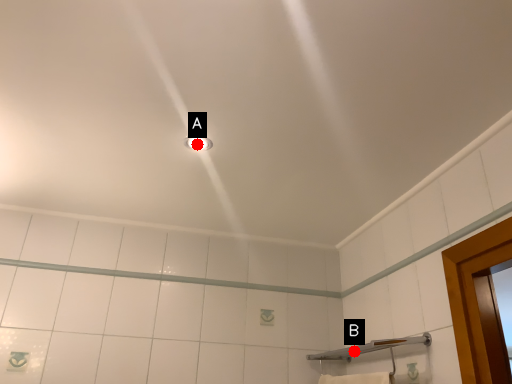
Question: Two points are circled on the image, labeled by A and B beside each circle. Among these points, which one is farthest from the camera?

Choices:
 (A) A is further
 (B) B is further

Answer: (B)